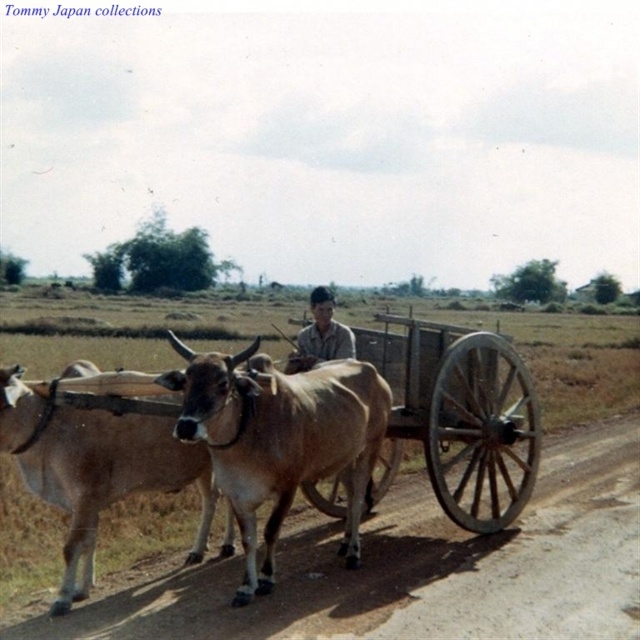
You are standing in the open field and see the wooden wagon at center and the light brown shirt at center. Which object is closer to you?

The wooden wagon at center is closer to you because it is in front of the light brown shirt at center.

You are standing in the field and see the wooden wagon at center. Where is the wooden wagon at center located relative to the point marked at coordinates (458, 417)?

The wooden wagon at center is located exactly at the point marked at coordinates 0.657, 0.717.

You are a farmer who needs to determine if your light brown glossy bull at center can fit through a narrow gate that is only slightly wider than the wooden wagon at center. Based on their sizes, can the bull pass through the gate?

The light brown glossy bull at center is thinner than the wooden wagon at center, so the bull can pass through the gate since it is narrower than the wagon.